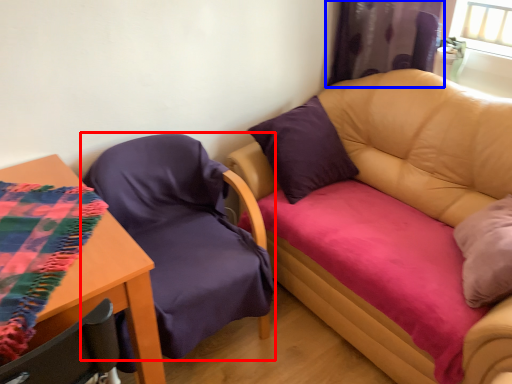
Question: Among these objects, which one is nearest to the camera, chair (highlighted by a red box) or curtain (highlighted by a blue box)?

Choices:
 (A) chair
 (B) curtain

Answer: (A)